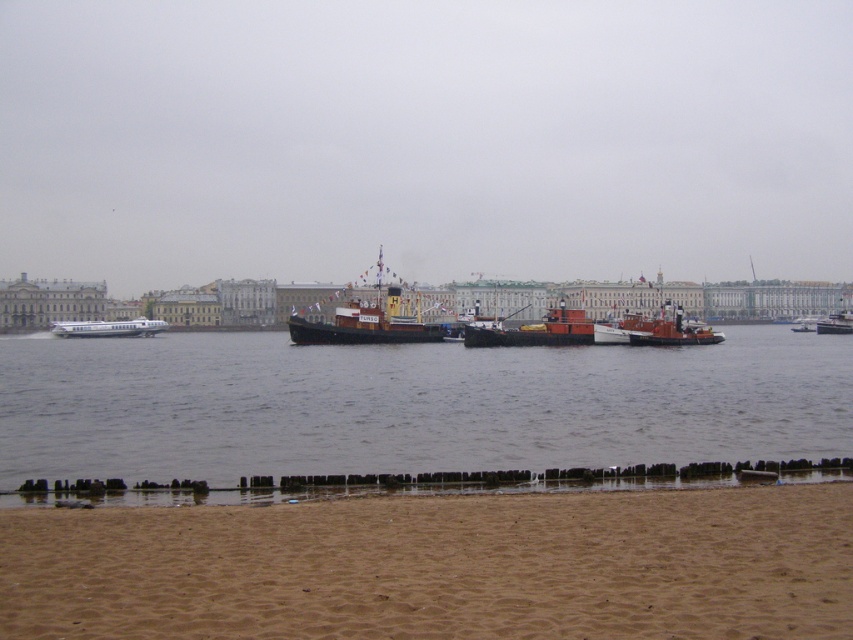
Between brown wooden water at lower center and metallic red boat at center, which one is positioned lower?

brown wooden water at lower center is below.

Measure the distance between brown wooden water at lower center and metallic red boat at center.

brown wooden water at lower center and metallic red boat at center are 14.44 meters apart.

Find the location of `brown wooden water at lower center`. brown wooden water at lower center is located at coordinates (410, 404).

Where is `brown wooden water at lower center`? brown wooden water at lower center is located at coordinates (410, 404).

Can you confirm if metallic red boat at center is positioned to the right of metallic gray boat at center?

In fact, metallic red boat at center is to the left of metallic gray boat at center.

Which is in front, point (523, 344) or point (833, 316)?

Positioned in front is point (523, 344).

Is point (495, 342) closer to camera compared to point (834, 317)?

Yes, point (495, 342) is closer to viewer.

Find the location of a particular element. metallic red boat at center is located at coordinates (537, 332).

Who is taller, metallic red boat at center or orange matte tugboat at center?

metallic red boat at center

Between point (538, 337) and point (642, 324), which one is positioned in front?

Point (538, 337) is more forward.

Find the location of a particular element. metallic red boat at center is located at coordinates (537, 332).